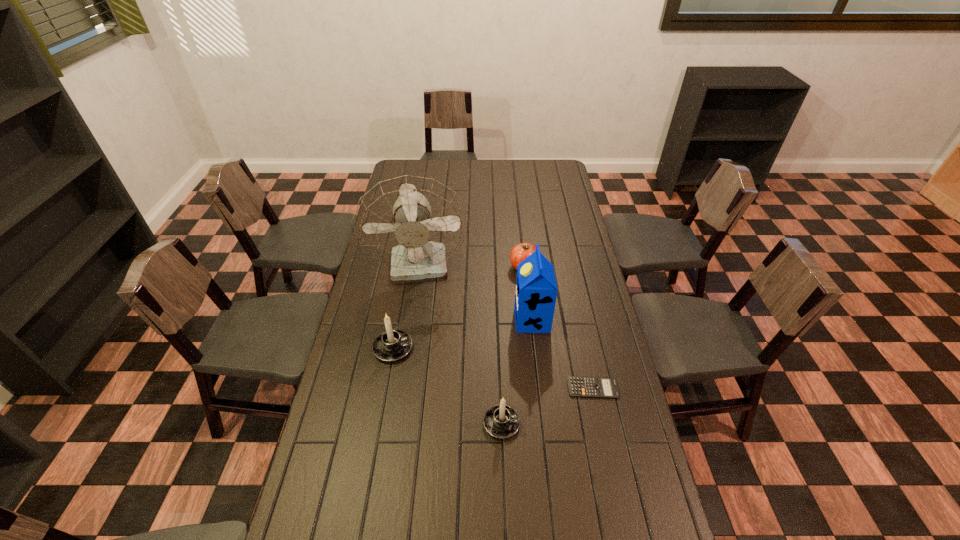
Where is `vacant point located between the third object from left to right and the apple`? The height and width of the screenshot is (540, 960). vacant point located between the third object from left to right and the apple is located at coordinates (513, 345).

Identify the location of free space that is in between the nearer candle holder and the second shortest object. The image size is (960, 540). [513, 345].

Locate an element on the screen. The width and height of the screenshot is (960, 540). free space between the carton and the calculator is located at coordinates (563, 354).

This screenshot has height=540, width=960. I want to click on vacant point located between the third object from left to right and the second tallest object, so click(x=516, y=372).

This screenshot has height=540, width=960. Find the location of `unoccupied position between the second shortest object and the fan`. unoccupied position between the second shortest object and the fan is located at coordinates (473, 267).

Choose which object is the fourth nearest neighbor to the second nearest object. Please provide its 2D coordinates. Your answer should be formatted as a tuple, i.e. [(x, y)], where the tuple contains the x and y coordinates of a point satisfying the conditions above.

[(413, 224)]

Find the location of `object that is the third closest to the second shortest object`. object that is the third closest to the second shortest object is located at coordinates (392, 345).

Find the location of a particular element. vacant position in the image that satisfies the following two spatial constraints: 1. with the cap open on the fifth shortest object; 2. on the right side of the shortest object is located at coordinates (540, 388).

Where is `vacant space that satisfies the following two spatial constraints: 1. in front of the rightmost object to blow air; 2. on the right side of the fan`? This screenshot has height=540, width=960. vacant space that satisfies the following two spatial constraints: 1. in front of the rightmost object to blow air; 2. on the right side of the fan is located at coordinates pyautogui.click(x=404, y=388).

Where is `free space that satisfies the following two spatial constraints: 1. on the back side of the calculator; 2. with the cap open on the second tallest object`? This screenshot has width=960, height=540. free space that satisfies the following two spatial constraints: 1. on the back side of the calculator; 2. with the cap open on the second tallest object is located at coordinates (578, 320).